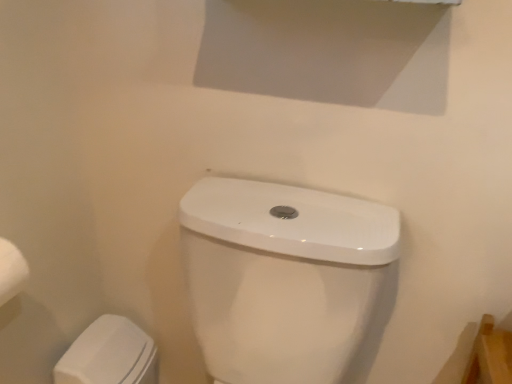
Measure the distance between point (366, 366) and camera.

They are 36.89 inches apart.

Find the location of a particular element. white glossy toilet at lower center is located at coordinates (287, 280).

What do you see at coordinates (287, 280) in the screenshot? I see `white glossy toilet at lower center` at bounding box center [287, 280].

This screenshot has height=384, width=512. What do you see at coordinates (109, 355) in the screenshot?
I see `white glossy porcelain at lower left` at bounding box center [109, 355].

Find the location of a particular element. white glossy porcelain at lower left is located at coordinates (109, 355).

Measure the distance between point (124,362) and camera.

Point (124,362) is 39.29 inches away from camera.

At what (x,y) coordinates should I click in order to perform the action: click on white glossy toilet at lower center. Please return your answer as a coordinate pair (x, y). Image resolution: width=512 pixels, height=384 pixels. Looking at the image, I should click on (287, 280).

Considering the positions of objects white glossy porcelain at lower left and white glossy toilet at lower center in the image provided, who is more to the left, white glossy porcelain at lower left or white glossy toilet at lower center?

white glossy porcelain at lower left.

Does white glossy porcelain at lower left come in front of white glossy toilet at lower center?

No, it is not.

Does point (134, 346) come farther from viewer compared to point (301, 203)?

That is True.

From the image's perspective, is white glossy porcelain at lower left above or below white glossy toilet at lower center?

From the image's perspective, white glossy porcelain at lower left appears below white glossy toilet at lower center.

From a real-world perspective, relative to white glossy toilet at lower center, is white glossy porcelain at lower left vertically above or below?

In terms of real-world spatial position, white glossy porcelain at lower left is below white glossy toilet at lower center.

In terms of width, does white glossy porcelain at lower left look wider or thinner when compared to white glossy toilet at lower center?

white glossy porcelain at lower left is thinner than white glossy toilet at lower center.

Can you confirm if white glossy porcelain at lower left is taller than white glossy toilet at lower center?

In fact, white glossy porcelain at lower left may be shorter than white glossy toilet at lower center.

Is white glossy porcelain at lower left bigger or smaller than white glossy toilet at lower center?

In the image, white glossy porcelain at lower left appears to be smaller than white glossy toilet at lower center.

Is white glossy porcelain at lower left positioned beyond the bounds of white glossy toilet at lower center?

Absolutely, white glossy porcelain at lower left is external to white glossy toilet at lower center.

Is white glossy porcelain at lower left far away from white glossy toilet at lower center?

No.

Is white glossy porcelain at lower left looking in the opposite direction of white glossy toilet at lower center?

No, white glossy porcelain at lower left is not facing the opposite direction of white glossy toilet at lower center.

How different are the orientations of white glossy porcelain at lower left and white glossy toilet at lower center in degrees?

90.4 degrees separate the facing orientations of white glossy porcelain at lower left and white glossy toilet at lower center.

This screenshot has width=512, height=384. Find the location of `sink on the right of white glossy porcelain at lower left`. sink on the right of white glossy porcelain at lower left is located at coordinates (287, 280).

Considering the positions of objects white glossy toilet at lower center and white glossy porcelain at lower left in the image provided, who is more to the right, white glossy toilet at lower center or white glossy porcelain at lower left?

white glossy toilet at lower center.

Which is behind, white glossy toilet at lower center or white glossy porcelain at lower left?

white glossy porcelain at lower left is more distant.

Is point (325, 205) in front of point (152, 345)?

Yes, point (325, 205) is in front of point (152, 345).

From the image's perspective, is white glossy toilet at lower center located above or below white glossy porcelain at lower left?

white glossy toilet at lower center is situated higher than white glossy porcelain at lower left in the image.

From a real-world perspective, is white glossy toilet at lower center below white glossy porcelain at lower left?

Incorrect, from a real-world perspective, white glossy toilet at lower center is higher than white glossy porcelain at lower left.

Which of these two, white glossy toilet at lower center or white glossy porcelain at lower left, is thinner?

white glossy porcelain at lower left is thinner.

Between white glossy toilet at lower center and white glossy porcelain at lower left, which one has less height?

white glossy porcelain at lower left is shorter.

Between white glossy toilet at lower center and white glossy porcelain at lower left, which one has larger size?

white glossy toilet at lower center.

Is white glossy toilet at lower center positioned beyond the bounds of white glossy porcelain at lower left?

Absolutely, white glossy toilet at lower center is external to white glossy porcelain at lower left.

Is white glossy toilet at lower center in contact with white glossy porcelain at lower left?

No, white glossy toilet at lower center is not making contact with white glossy porcelain at lower left.

Is white glossy toilet at lower center oriented away from white glossy porcelain at lower left?

No, white glossy toilet at lower center is not facing away from white glossy porcelain at lower left.

Can you tell me how much white glossy toilet at lower center and white glossy porcelain at lower left differ in facing direction?

The facing directions of white glossy toilet at lower center and white glossy porcelain at lower left are 90.4 degrees apart.

In the scene shown: How far apart are white glossy toilet at lower center and white glossy porcelain at lower left?

They are 18.10 inches apart.

Locate an element on the screen. sink to the right of white glossy porcelain at lower left is located at coordinates (287, 280).

Where is `sink that appears above the white glossy porcelain at lower left (from a real-world perspective)`? The height and width of the screenshot is (384, 512). sink that appears above the white glossy porcelain at lower left (from a real-world perspective) is located at coordinates (287, 280).

You are a GUI agent. You are given a task and a screenshot of the screen. Output one action in this format:
    pyautogui.click(x=<x>, y=<y>)
    Task: Click on the porcelain on the left of white glossy toilet at lower center
    The width and height of the screenshot is (512, 384).
    Given the screenshot: What is the action you would take?
    pyautogui.click(x=109, y=355)